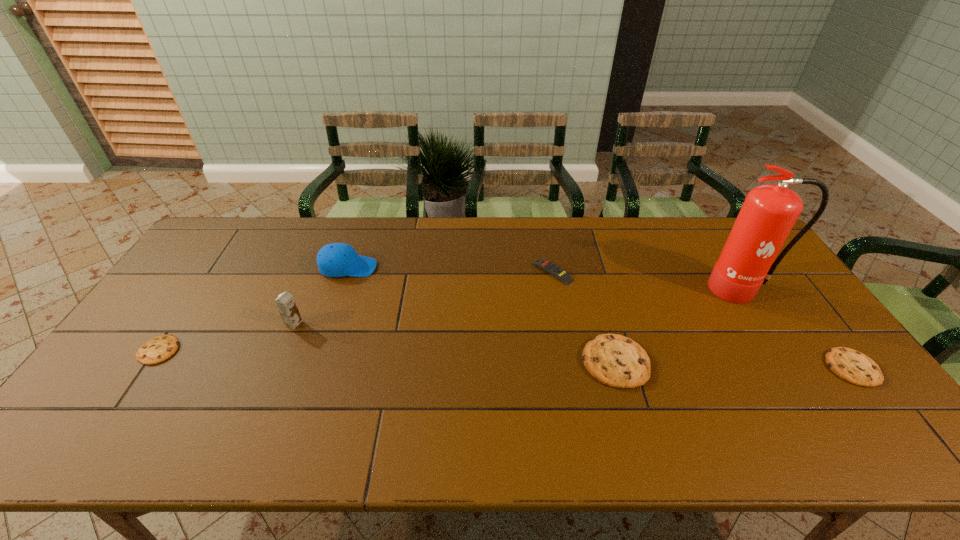
The image size is (960, 540). Identify the location of the leftmost object. (160, 348).

You are a GUI agent. You are given a task and a screenshot of the screen. Output one action in this format:
    pyautogui.click(x=<x>, y=<y>)
    Task: Click on the leftmost cookie
    The image size is (960, 540).
    Given the screenshot: What is the action you would take?
    pyautogui.click(x=160, y=348)

The height and width of the screenshot is (540, 960). I want to click on the second cookie from left to right, so click(615, 360).

Identify the location of the tallest cookie. (615, 360).

Locate an element on the screen. The width and height of the screenshot is (960, 540). the second shortest cookie is located at coordinates (850, 365).

Find the location of `cap`. cap is located at coordinates (336, 259).

Locate an element on the screen. remote control is located at coordinates (546, 265).

At what (x,y) coordinates should I click in order to perform the action: click on the second tallest object. Please return your answer as a coordinate pair (x, y). This screenshot has height=540, width=960. Looking at the image, I should click on (285, 302).

Locate an element on the screen. The width and height of the screenshot is (960, 540). chocolate milk is located at coordinates [285, 302].

Locate an element on the screen. the tallest object is located at coordinates (769, 212).